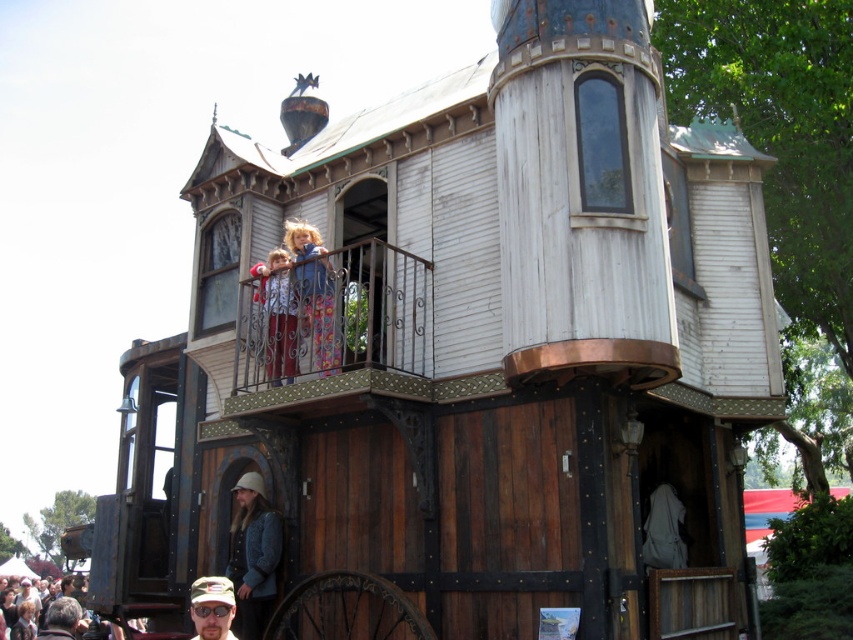
Describe the element at coordinates (253, 556) in the screenshot. I see `denim jacket at lower center` at that location.

Consider the image. Who is positioned more to the left, denim jacket at lower center or camouflage fabric cap at lower center?

camouflage fabric cap at lower center

Between point (234, 534) and point (216, 595), which one is positioned in front?

Point (216, 595)

Locate an element on the screen. This screenshot has width=853, height=640. denim jacket at lower center is located at coordinates coord(253,556).

Is denim jacket at lower center positioned in front of matte gray jacket at lower left?

Yes, it is in front of matte gray jacket at lower left.

Where is `denim jacket at lower center`? The width and height of the screenshot is (853, 640). denim jacket at lower center is located at coordinates (253, 556).

Does point (212, 632) come behind point (73, 605)?

No.

Is camouflage fabric cap at lower center in front of matte gray jacket at lower left?

Yes, camouflage fabric cap at lower center is in front of matte gray jacket at lower left.

What do you see at coordinates (212, 608) in the screenshot? I see `camouflage fabric cap at lower center` at bounding box center [212, 608].

Image resolution: width=853 pixels, height=640 pixels. Find the location of `camouflage fabric cap at lower center`. camouflage fabric cap at lower center is located at coordinates coord(212,608).